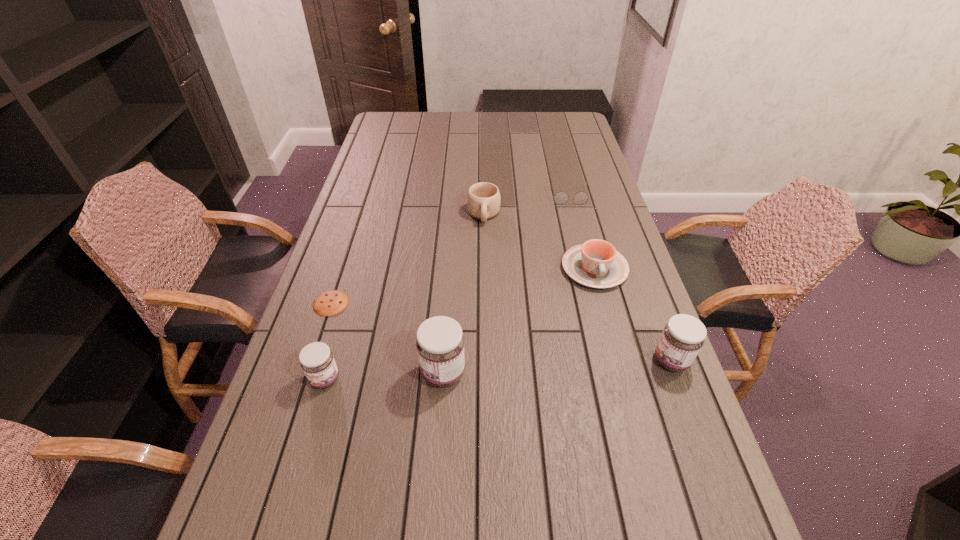
Identify which object is the third nearest to the cookie. Please provide its 2D coordinates. Your answer should be formatted as a tuple, i.e. [(x, y)], where the tuple contains the x and y coordinates of a point satisfying the conditions above.

[(483, 199)]

Select which object appears as the second closest to the mug. Please provide its 2D coordinates. Your answer should be formatted as a tuple, i.e. [(x, y)], where the tuple contains the x and y coordinates of a point satisfying the conditions above.

[(595, 263)]

Locate which jam ranks in proximity to the mug. Please provide its 2D coordinates. Your answer should be formatted as a tuple, i.e. [(x, y)], where the tuple contains the x and y coordinates of a point satisfying the conditions above.

[(440, 343)]

Select which jam is the second closest to the shortest object. Please provide its 2D coordinates. Your answer should be formatted as a tuple, i.e. [(x, y)], where the tuple contains the x and y coordinates of a point satisfying the conditions above.

[(440, 343)]

You are a GUI agent. You are given a task and a screenshot of the screen. Output one action in this format:
    pyautogui.click(x=<x>, y=<y>)
    Task: Click on the vacant space that satisfies the following two spatial constraints: 1. on the side of the mug with the handle; 2. on the front label of the tallest object
    The width and height of the screenshot is (960, 540).
    Given the screenshot: What is the action you would take?
    pyautogui.click(x=486, y=373)

You are a GUI agent. You are given a task and a screenshot of the screen. Output one action in this format:
    pyautogui.click(x=<x>, y=<y>)
    Task: Click on the free spot that satisfies the following two spatial constraints: 1. on the temples of the second shortest object; 2. on the front label of the tallest object
    Image resolution: width=960 pixels, height=540 pixels.
    Given the screenshot: What is the action you would take?
    pyautogui.click(x=612, y=373)